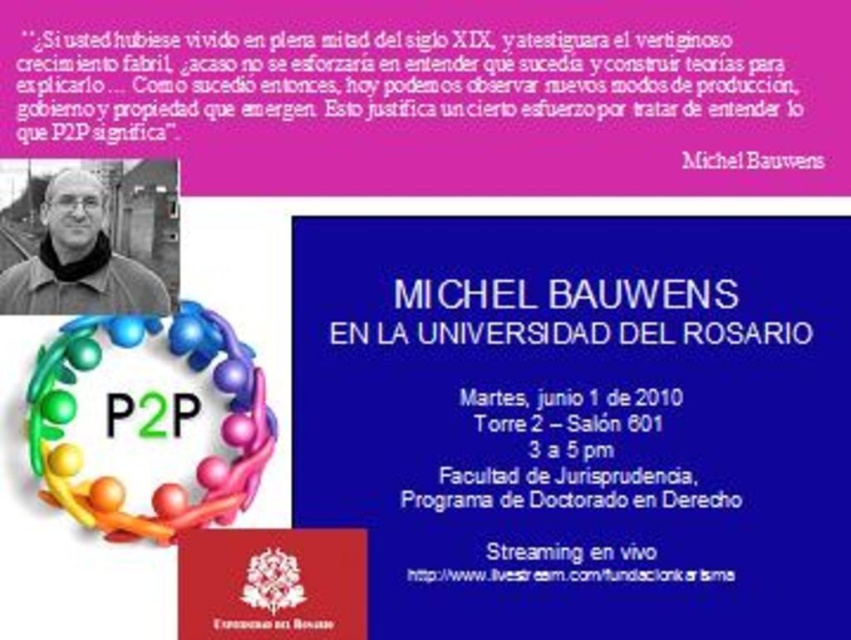
Based on the photo, is pink paper at upper center above white text on blue background at center?

Indeed, pink paper at upper center is positioned over white text on blue background at center.

Who is more forward, (718, 83) or (397, 305)?

Point (718, 83) is more forward.

Between point (123, 129) and point (641, 340), which one is positioned behind?

The point (641, 340) is behind.

Image resolution: width=851 pixels, height=640 pixels. I want to click on pink paper at upper center, so click(375, 83).

Does pink paper at upper center appear on the left side of matte black jacket at upper left?

No, pink paper at upper center is not to the left of matte black jacket at upper left.

Between pink paper at upper center and matte black jacket at upper left, which one appears on the right side from the viewer's perspective?

pink paper at upper center is more to the right.

I want to click on pink paper at upper center, so click(x=375, y=83).

Does white text on blue background at center have a larger size compared to black paper at upper center?

Indeed, white text on blue background at center has a larger size compared to black paper at upper center.

This screenshot has height=640, width=851. What do you see at coordinates (569, 332) in the screenshot?
I see `white text on blue background at center` at bounding box center [569, 332].

You are a GUI agent. You are given a task and a screenshot of the screen. Output one action in this format:
    pyautogui.click(x=<x>, y=<y>)
    Task: Click on the white text on blue background at center
    
    Given the screenshot: What is the action you would take?
    pyautogui.click(x=569, y=332)